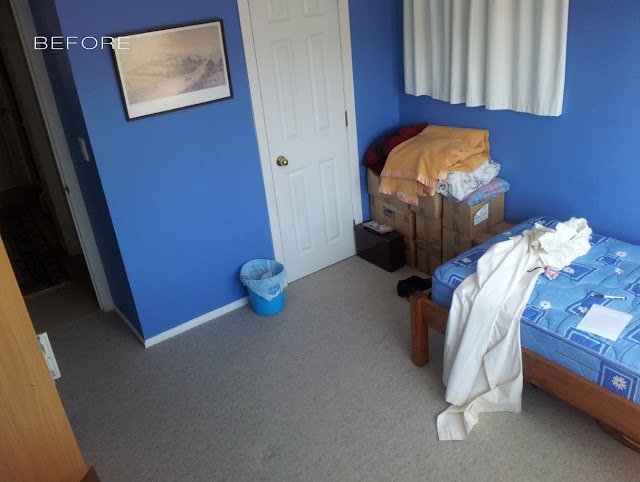
Identify the location of light switch. (84, 153).